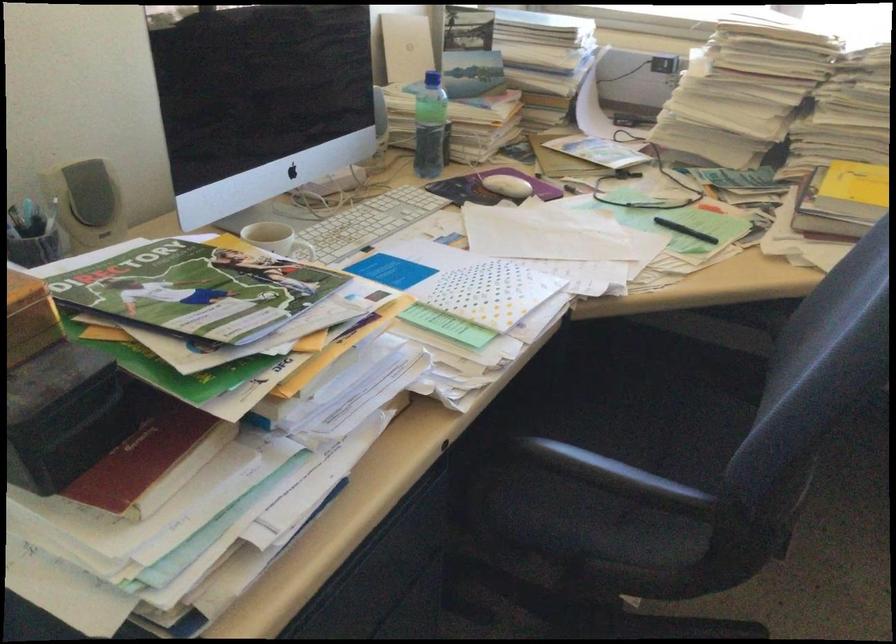
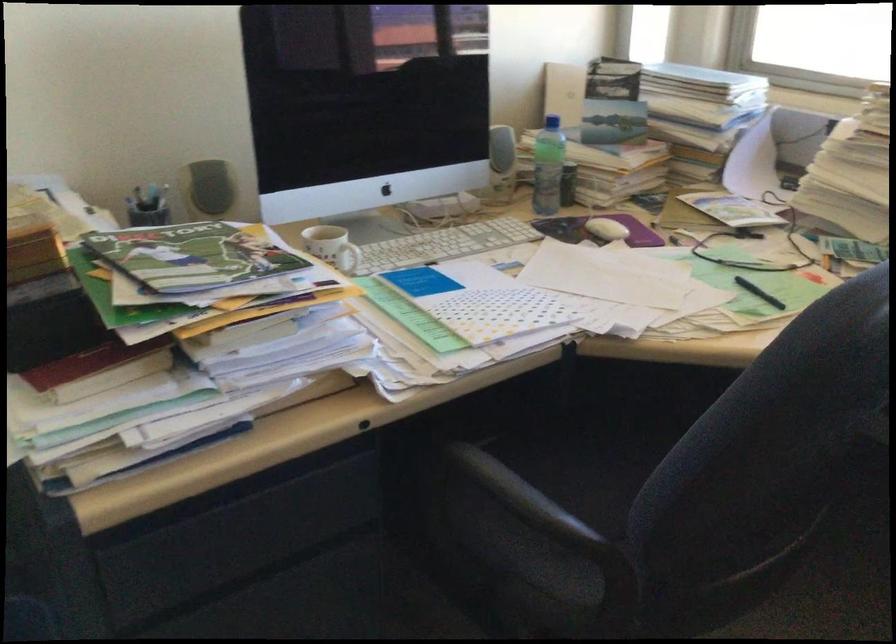
Question: In a continuous first-person perspective shot, in which direction is the camera moving?

Choices:
 (A) Left
 (B) Right
 (C) Forward
 (D) Backward

Answer: (B)